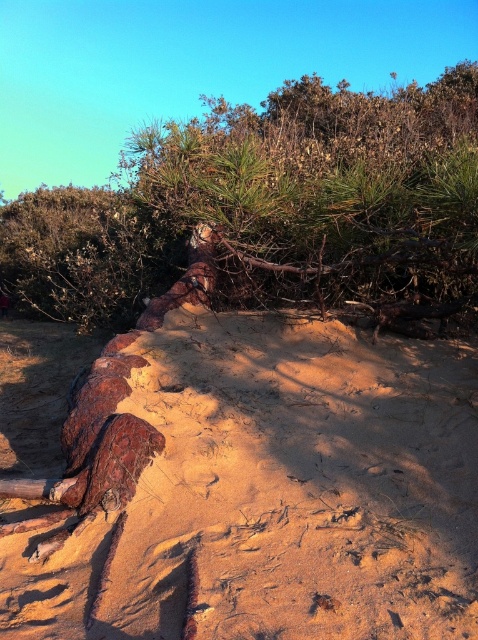
Question: Observing the image, what is the correct spatial positioning of rusty metallic log at lower left in reference to brown bark tree at center?

Choices:
 (A) above
 (B) below

Answer: (B)

Question: Does rusty metallic log at lower left have a smaller size compared to brown bark tree at center?

Choices:
 (A) yes
 (B) no

Answer: (A)

Question: Which point is closer to the camera?

Choices:
 (A) rusty metallic log at lower left
 (B) brown bark tree at center

Answer: (A)

Question: Which of the following is the farthest from the observer?

Choices:
 (A) coord(347,124)
 (B) coord(364,520)

Answer: (A)

Question: Does rusty metallic log at lower left have a smaller size compared to brown bark tree at center?

Choices:
 (A) no
 (B) yes

Answer: (B)

Question: Among these points, which one is nearest to the camera?

Choices:
 (A) (25, 572)
 (B) (281, 209)

Answer: (A)